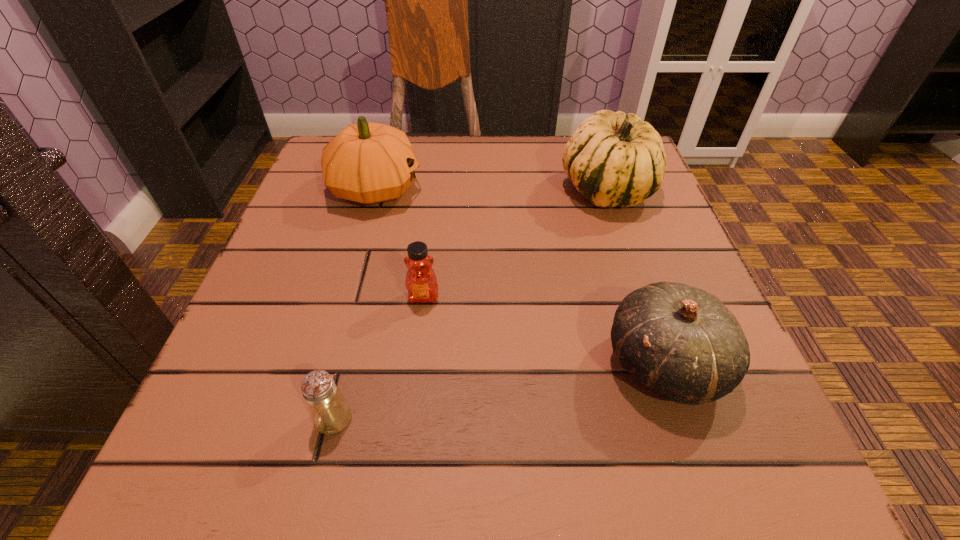
This screenshot has width=960, height=540. In order to click on the leftmost gourd in this screenshot , I will do `click(367, 162)`.

The width and height of the screenshot is (960, 540). What are the coordinates of `the shortest gourd` in the screenshot? It's located at (680, 341).

Locate an element on the screen. This screenshot has width=960, height=540. the third tallest object is located at coordinates (680, 341).

Find the location of a particular element. This screenshot has height=540, width=960. the third nearest object is located at coordinates (421, 282).

Find the location of `the third object from right to left`. the third object from right to left is located at coordinates (421, 282).

Locate an element on the screen. The height and width of the screenshot is (540, 960). saltshaker is located at coordinates (330, 412).

Where is `vacant space located on the side of the leftmost gourd with the carved face`? The width and height of the screenshot is (960, 540). vacant space located on the side of the leftmost gourd with the carved face is located at coordinates (498, 189).

Find the location of a particular element. free space located on the back of the shortest gourd is located at coordinates (616, 224).

This screenshot has width=960, height=540. I want to click on free spot located on the front label of the honey, so click(413, 386).

Find the location of a particular element. blank area located 0.320m on the back of the saltshaker is located at coordinates (376, 243).